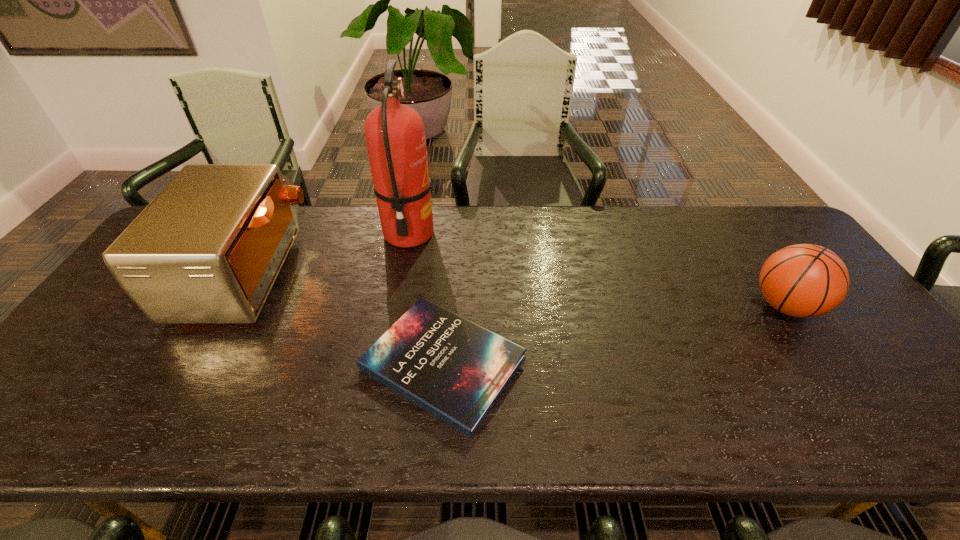
In order to click on fire extinguisher in this screenshot , I will do `click(395, 137)`.

Locate an element on the screen. This screenshot has height=540, width=960. the third shortest object is located at coordinates (208, 248).

Find the location of `toaster oven`. toaster oven is located at coordinates (208, 248).

Identify the location of the rightmost object. This screenshot has width=960, height=540. (804, 280).

Locate an element on the screen. the third tallest object is located at coordinates (804, 280).

Where is `the shortest object`? This screenshot has height=540, width=960. the shortest object is located at coordinates (455, 369).

In order to click on vacant space located on the side of the tallest object with the nozzle and handle in this screenshot , I will do `click(463, 234)`.

The width and height of the screenshot is (960, 540). I want to click on vacant region located 0.280m on the door side of the leftmost object, so click(395, 274).

Identify the location of vacant space located 0.080m on the back of the third tallest object. (756, 263).

The image size is (960, 540). I want to click on free space located 0.120m on the right of the hardback book, so click(576, 363).